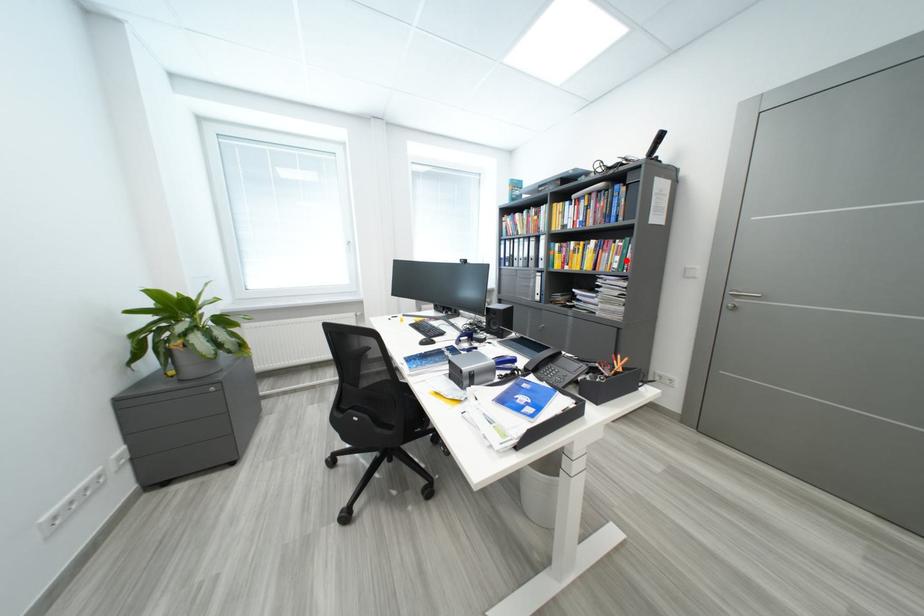
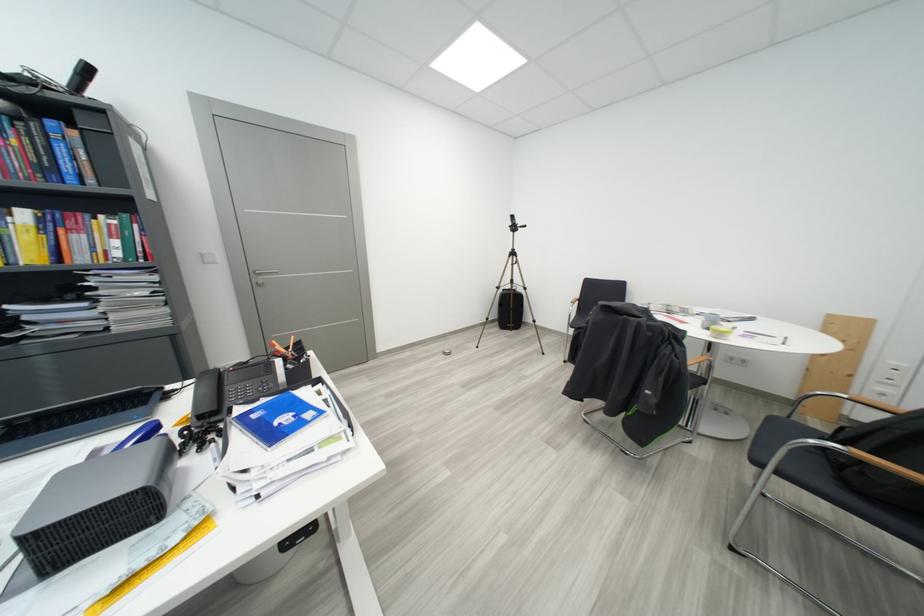
The point at the highlighted location is marked in the first image. Where is the corresponding point in the second image?

(126, 245)